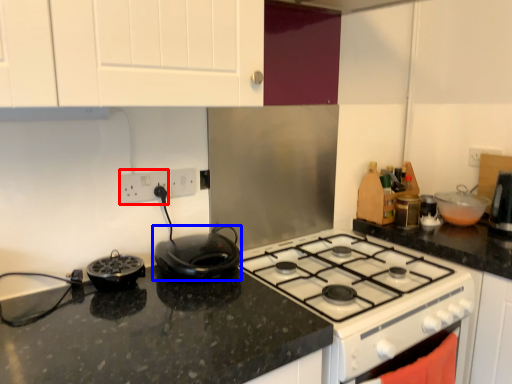
Question: Which point is further to the camera, electric outlet (highlighted by a red box) or kitchen appliance (highlighted by a blue box)?

Choices:
 (A) electric outlet
 (B) kitchen appliance

Answer: (A)